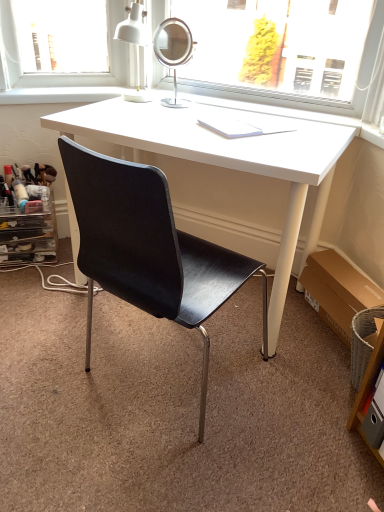
The image size is (384, 512). What are the coordinates of `free space in front of brown cardboard box at lower right` in the screenshot? It's located at (310, 365).